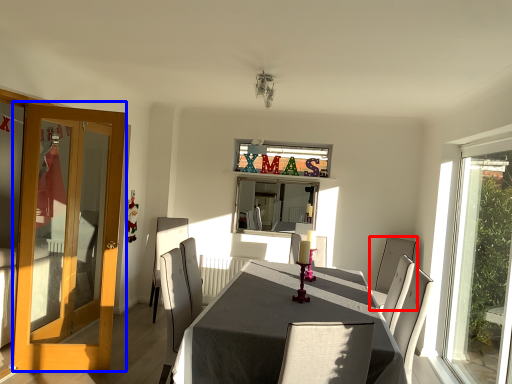
Question: Among these objects, which one is nearest to the camera, chair (highlighted by a red box) or door (highlighted by a blue box)?

Choices:
 (A) chair
 (B) door

Answer: (B)